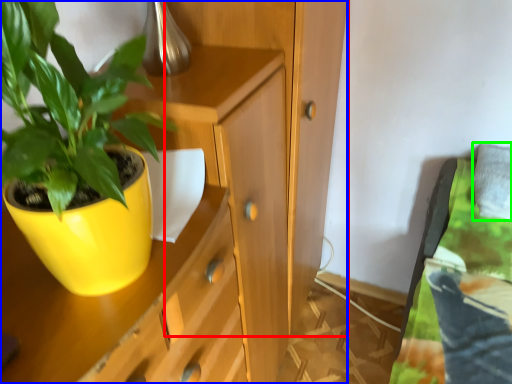
Question: Which object is the closest to the dresser (highlighted by a red box)? Choose among these: cabinetry (highlighted by a blue box) or pillow (highlighted by a green box).

Choices:
 (A) cabinetry
 (B) pillow

Answer: (A)